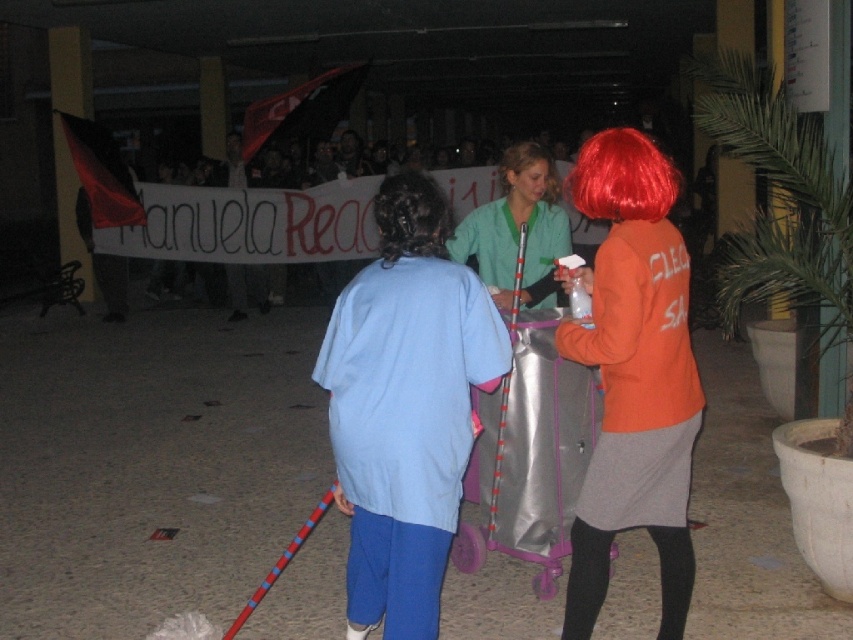
Can you confirm if light blue fabric shirt at center is smaller than red synthetic wig at upper right?

Actually, light blue fabric shirt at center might be larger than red synthetic wig at upper right.

Is light blue fabric shirt at center below red synthetic wig at upper right?

Indeed, light blue fabric shirt at center is positioned under red synthetic wig at upper right.

Is point (415, 513) farther from camera compared to point (654, 164)?

That is False.

Where is `light blue fabric shirt at center`? The width and height of the screenshot is (853, 640). light blue fabric shirt at center is located at coordinates (405, 406).

Find the location of a particular element. The image size is (853, 640). green smoothie at center is located at coordinates (517, 228).

Identify the location of green smoothie at center. (517, 228).

Identify the location of green smoothie at center. (517, 228).

How much distance is there between orange matte jacket at right and green smoothie at center?

orange matte jacket at right is 91.83 centimeters away from green smoothie at center.

Is orange matte jacket at right shorter than green smoothie at center?

Incorrect, orange matte jacket at right's height does not fall short of green smoothie at center's.

Is point (621, 323) less distant than point (502, 196)?

That is True.

This screenshot has height=640, width=853. What are the coordinates of `orange matte jacket at right` in the screenshot? It's located at 633,376.